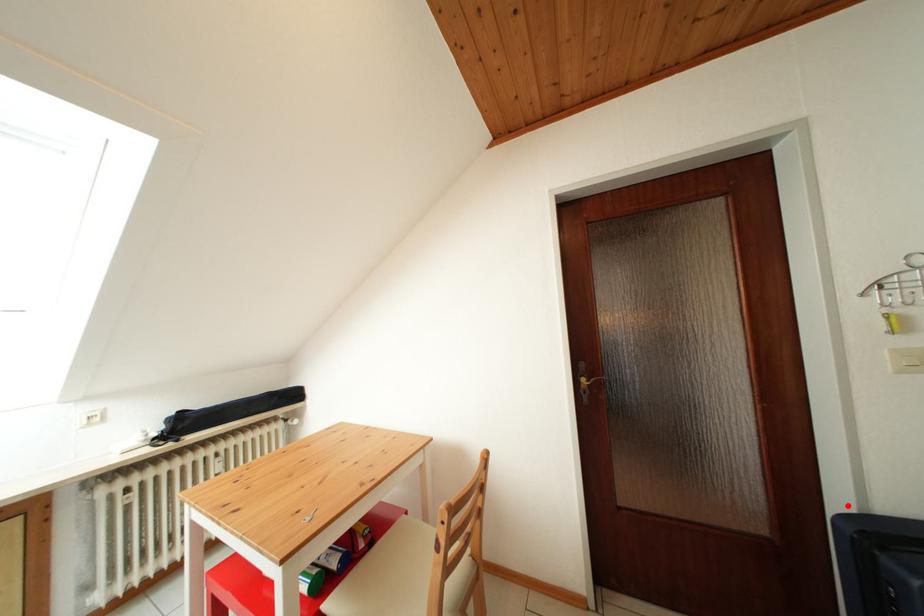
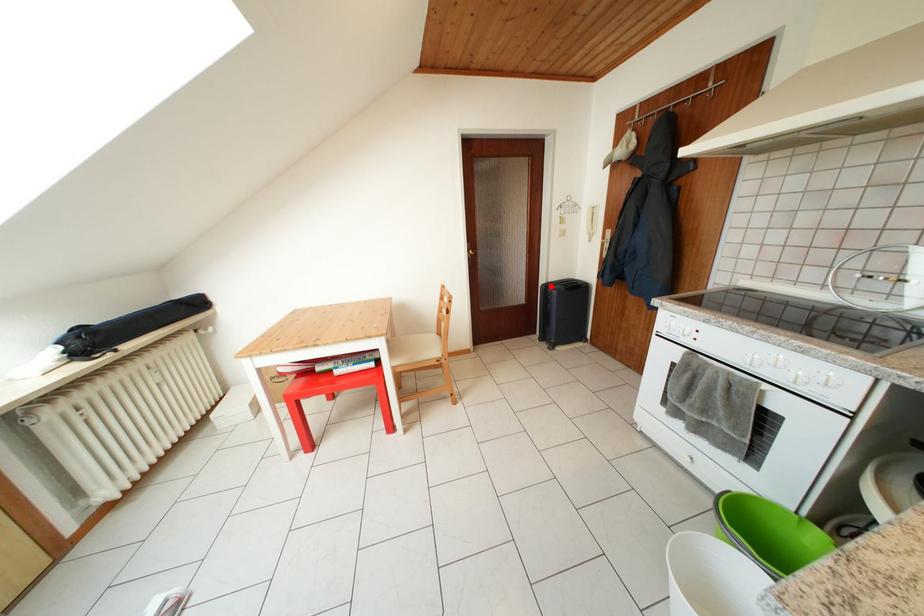
I am providing you with two images of the same scene from different viewpoints. A red point is marked on the first image and another point is marked on the second image. Do the highlighted points in image1 and image2 indicate the same real-world spot?

Yes